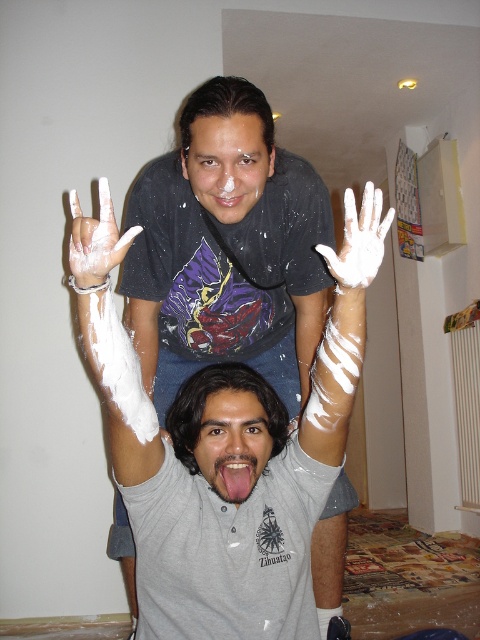
Does white matte face at center have a lesser width compared to smooth skin face at center?

No, white matte face at center is not thinner than smooth skin face at center.

Can you confirm if white matte face at center is wider than smooth skin face at center?

Yes, white matte face at center is wider than smooth skin face at center.

What are the coordinates of `white matte face at center` in the screenshot? It's located at (228, 163).

Who is positioned more to the left, white matte hand at upper center or white matte hand at center?

Positioned to the left is white matte hand at upper center.

Between point (90, 272) and point (336, 276), which one is positioned in front?

Point (90, 272) is in front.

Who is more distant from viewer, (70, 259) or (343, 252)?

Point (343, 252)

Identify the location of white matte hand at upper center. Image resolution: width=480 pixels, height=640 pixels. (96, 243).

You are a GUI agent. You are given a task and a screenshot of the screen. Output one action in this format:
    pyautogui.click(x=<x>, y=<y>)
    Task: Click on the smooth skin face at center
    
    Given the screenshot: What is the action you would take?
    pyautogui.click(x=232, y=442)

Between smooth skin face at center and white matte hand at upper center, which one is positioned lower?

Positioned lower is smooth skin face at center.

Is point (204, 458) farther from camera compared to point (83, 241)?

Yes, it is behind point (83, 241).

This screenshot has height=640, width=480. In order to click on smooth skin face at center in this screenshot , I will do `click(232, 442)`.